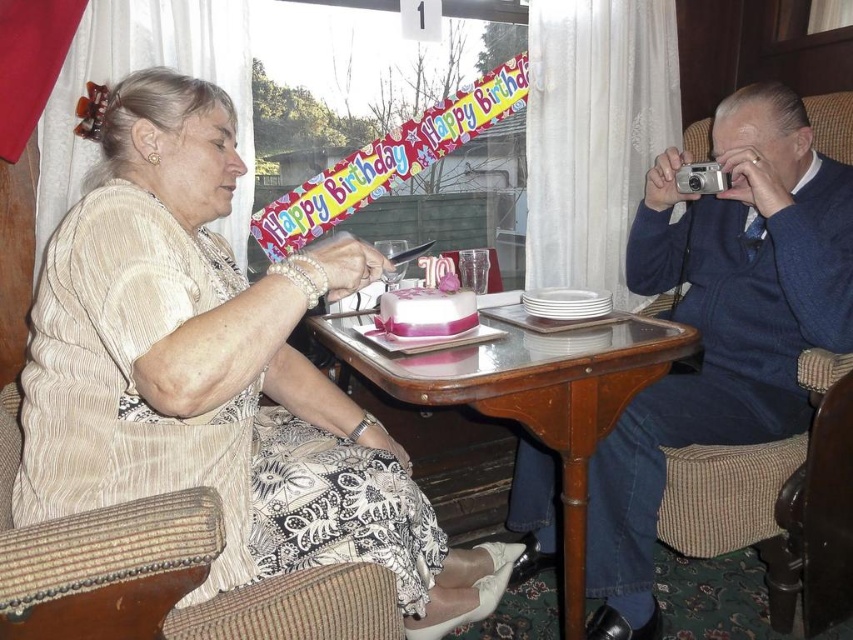
You are a photographer setting up for a birthday photo shoot. You need to ensure that both the matte beige blouse at upper left and the blue sweater at right are visible in the frame. Based on their positions, which clothing item is closer to the bottom of the image?

The matte beige blouse at upper left is located below the blue sweater at right, so it is closer to the bottom of the image.

You are standing in the room and want to know what is located at the coordinate point (x=218, y=374). What object is at that position?

The point (x=218, y=374) corresponds to the matte beige blouse at upper left.